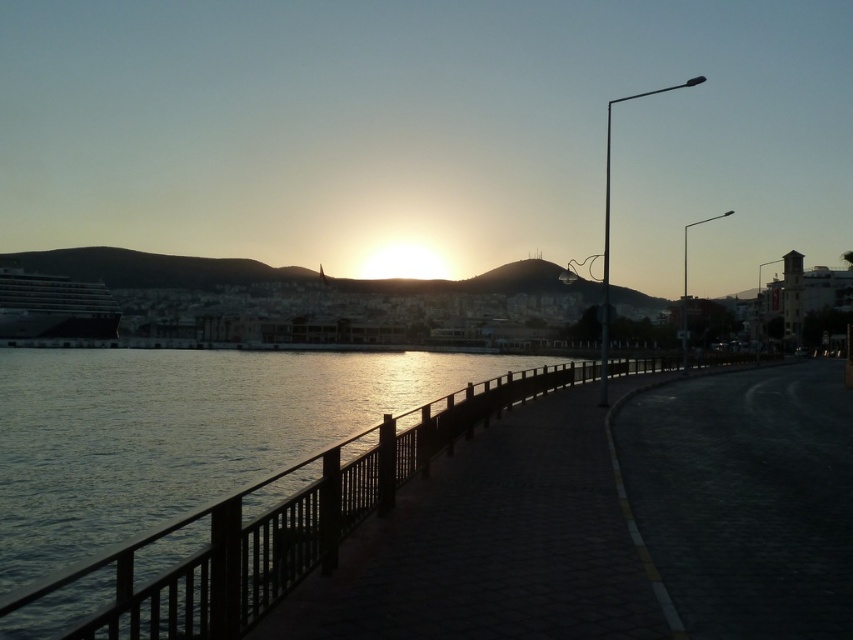
Is black wooden rail at center positioned at the back of dark gray metallic cruise ship at left?

No, black wooden rail at center is in front of dark gray metallic cruise ship at left.

From the picture: How far apart are black wooden rail at center and dark gray metallic cruise ship at left?

black wooden rail at center is 293.81 feet from dark gray metallic cruise ship at left.

Between point (544, 368) and point (97, 282), which one is positioned in front?

Point (544, 368)

Locate an element on the screen. The image size is (853, 640). black wooden rail at center is located at coordinates (262, 529).